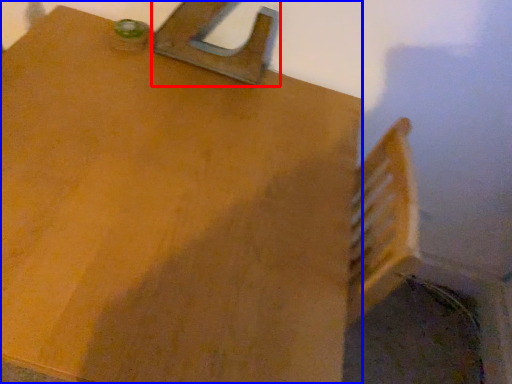
Question: Which of the following is the farthest to the observer, latch (highlighted by a red box) or table (highlighted by a blue box)?

Choices:
 (A) latch
 (B) table

Answer: (A)